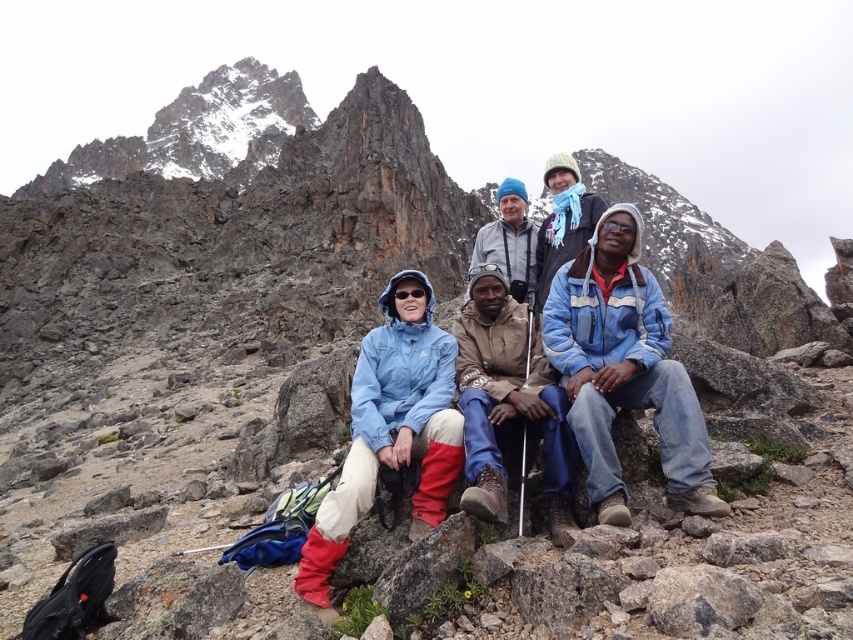
Question: Which of these objects is positioned closest to the matte blue jacket at center?

Choices:
 (A) blue denim jacket at lower right
 (B) blue knit hat at center

Answer: (A)

Question: Which point is farther to the camera?

Choices:
 (A) matte blue jacket at center
 (B) blue knit hat at center

Answer: (B)

Question: Does matte blue jacket at center have a smaller size compared to blue knit hat at center?

Choices:
 (A) yes
 (B) no

Answer: (B)

Question: In this image, where is blue denim jacket at lower right located relative to brown suede jacket at center?

Choices:
 (A) left
 (B) right

Answer: (B)

Question: Which object appears farthest from the camera in this image?

Choices:
 (A) matte blue jacket at center
 (B) blue knit hat at center

Answer: (B)

Question: Is blue denim jacket at lower right to the right of brown suede jacket at center from the viewer's perspective?

Choices:
 (A) yes
 (B) no

Answer: (A)